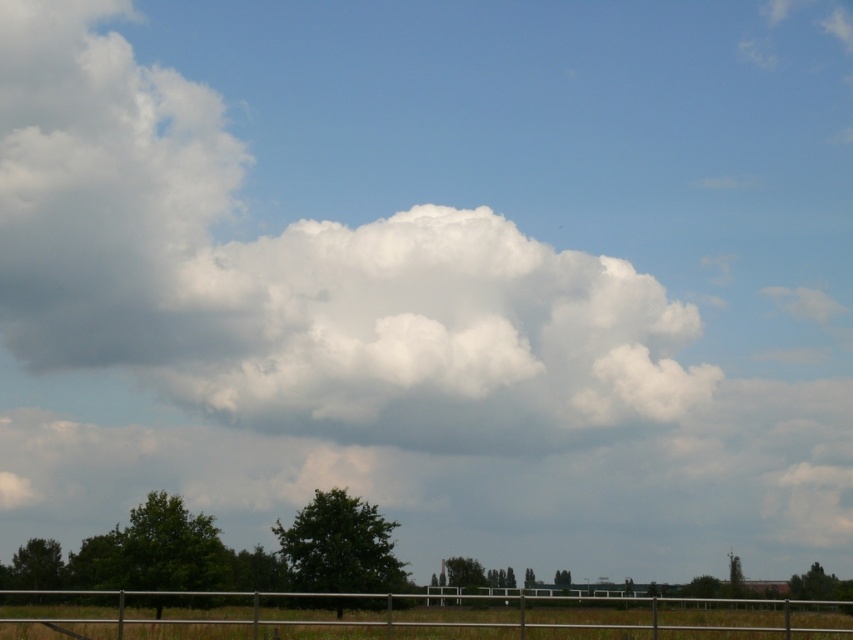
The width and height of the screenshot is (853, 640). Find the location of `white fluffy cloud at upper center`. white fluffy cloud at upper center is located at coordinates (296, 276).